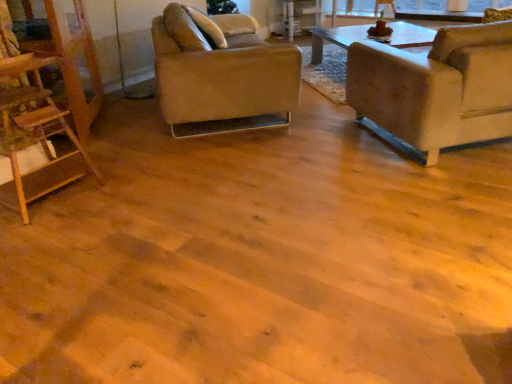
Question: Considering their positions, is orange mesh radiator at upper left located in front of or behind suede-like beige chair at right, the 2th chair in the left-to-right sequence?

Choices:
 (A) front
 (B) behind

Answer: (B)

Question: From their relative heights in the image, would you say orange mesh radiator at upper left is taller or shorter than suede-like beige chair at right, the first chair in the right-to-left sequence?

Choices:
 (A) tall
 (B) short

Answer: (B)

Question: Considering the real-world distances, which object is closest to the orange mesh radiator at upper left?

Choices:
 (A) wooden ladder at left
 (B) leather-like beige chair at center-left, which is the second chair from right to left
 (C) suede-like beige chair at right, the first chair in the right-to-left sequence

Answer: (B)

Question: Which object is the farthest from the leather-like beige chair at center-left, which is the second chair from right to left?

Choices:
 (A) suede-like beige chair at right, the 2th chair in the left-to-right sequence
 (B) wooden ladder at left
 (C) orange mesh radiator at upper left

Answer: (C)